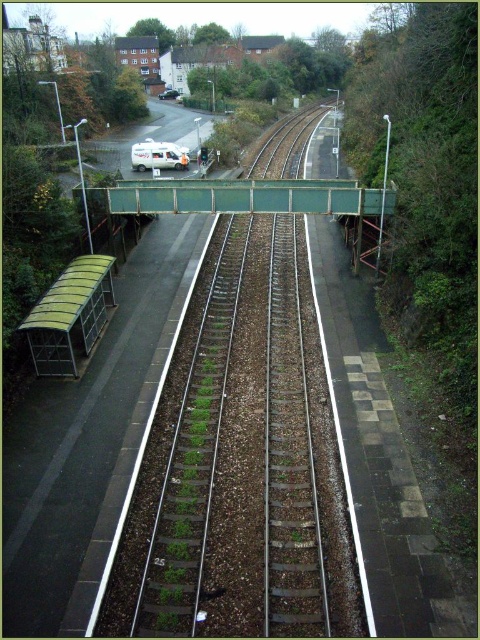
Which is more to the right, green metallic bridge at center or white matte van at upper center?

green metallic bridge at center is more to the right.

Does green metallic bridge at center appear over white matte van at upper center?

No.

Find the location of `green metallic bridge at center`. green metallic bridge at center is located at coordinates (241, 196).